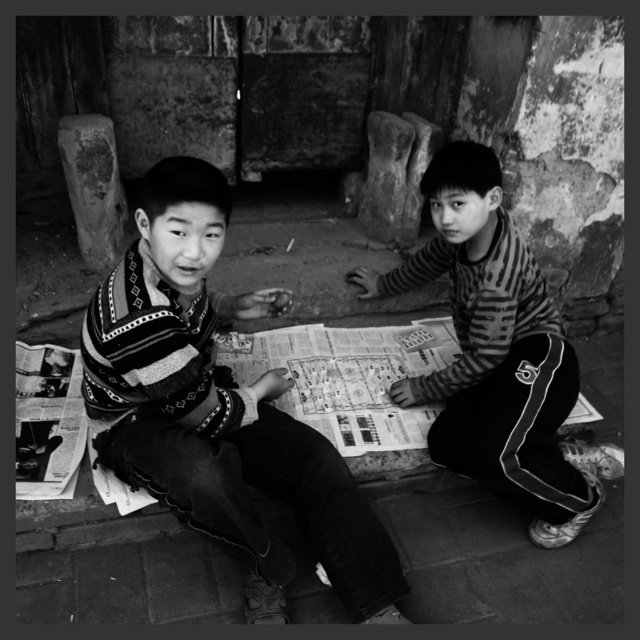
Does striped sweater at center have a lesser height compared to printed paper game at center?

No, striped sweater at center is not shorter than printed paper game at center.

Which is above, striped sweater at center or printed paper game at center?

printed paper game at center is higher up.

Between point (168, 328) and point (326, 340), which one is positioned behind?

The point (326, 340) is behind.

This screenshot has height=640, width=640. Find the location of `striped sweater at center`. striped sweater at center is located at coordinates (218, 408).

Is point (212, 220) farther from camera compared to point (573, 480)?

No, (212, 220) is in front of (573, 480).

Is striped sweater at center further to camera compared to striped fabric shirt at center?

No, striped sweater at center is closer to the viewer.

Who is more distant from viewer, (204, 358) or (467, 189)?

The point (467, 189) is more distant.

Image resolution: width=640 pixels, height=640 pixels. Identify the location of striped sweater at center. (218, 408).

Does striped fabric shirt at center lie behind printed paper game at center?

That is False.

Where is `striped fabric shirt at center`? The image size is (640, 640). striped fabric shirt at center is located at coordinates (497, 355).